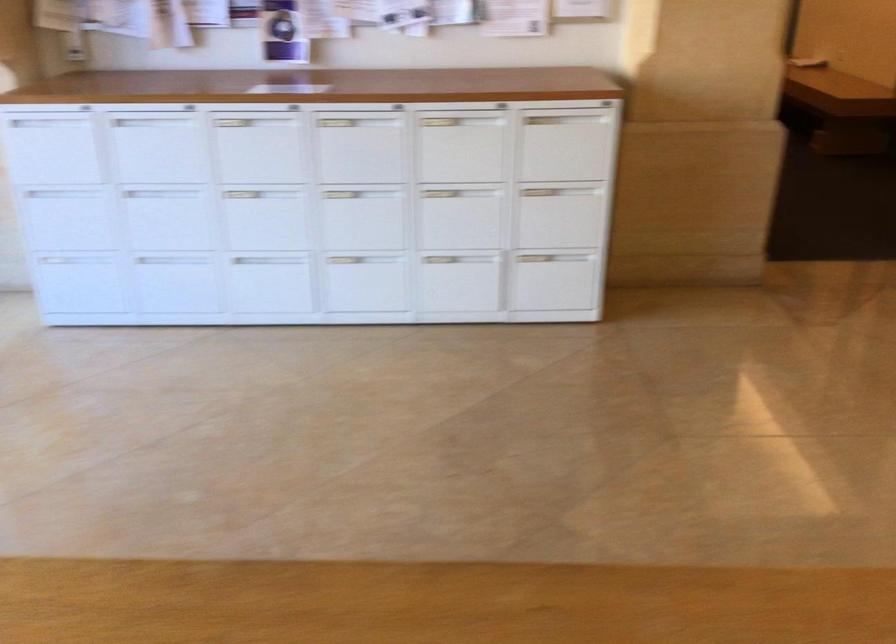
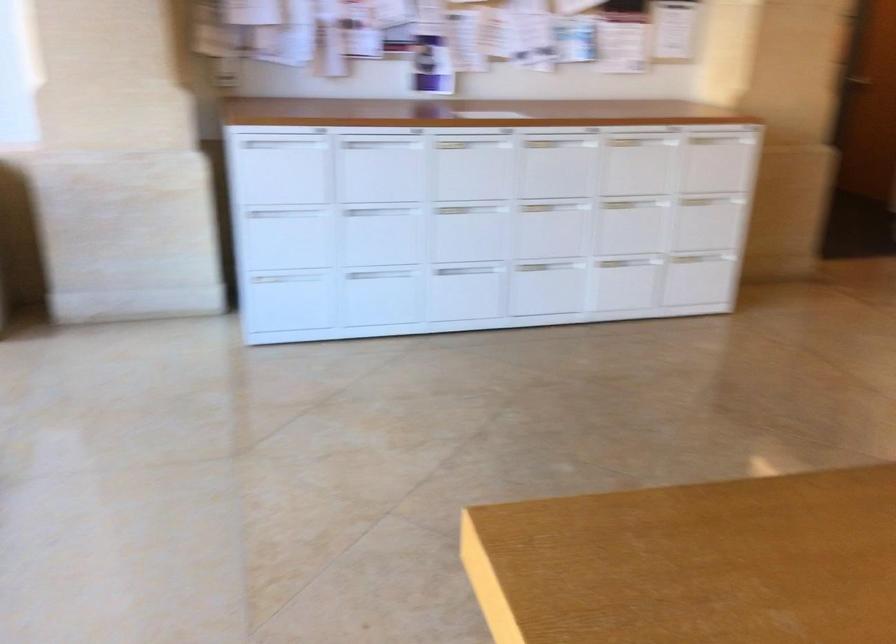
The point at (276,149) is marked in the first image. Where is the corresponding point in the second image?

(471, 167)